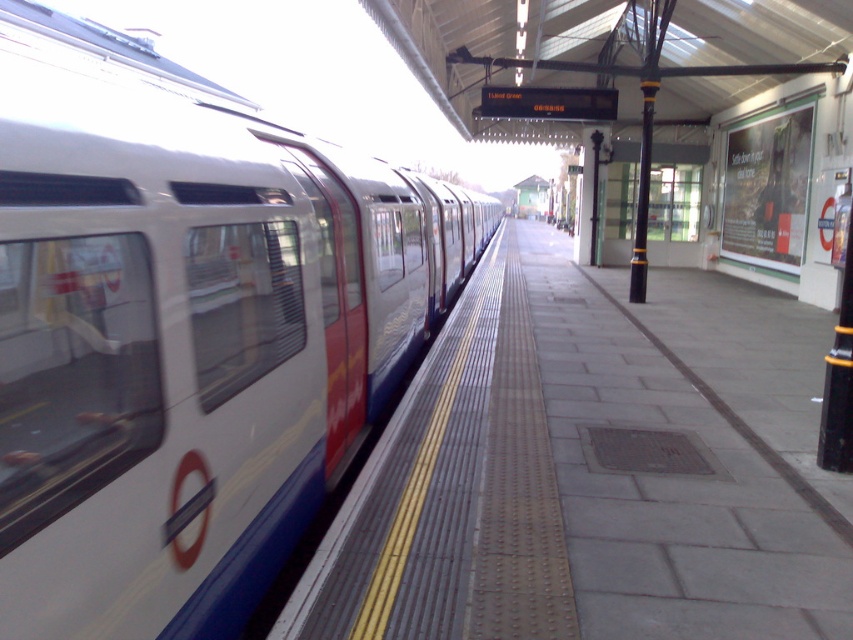
Question: Does white glossy train at left appear on the left side of metallic gray platform at center?

Choices:
 (A) no
 (B) yes

Answer: (B)

Question: Where is white glossy train at left located in relation to metallic gray platform at center in the image?

Choices:
 (A) left
 (B) right

Answer: (A)

Question: Is white glossy train at left smaller than metallic gray platform at center?

Choices:
 (A) yes
 (B) no

Answer: (B)

Question: Which point appears closest to the camera in this image?

Choices:
 (A) (363, 324)
 (B) (775, 579)

Answer: (B)

Question: Which point appears closest to the camera in this image?

Choices:
 (A) (453, 195)
 (B) (489, 632)

Answer: (B)